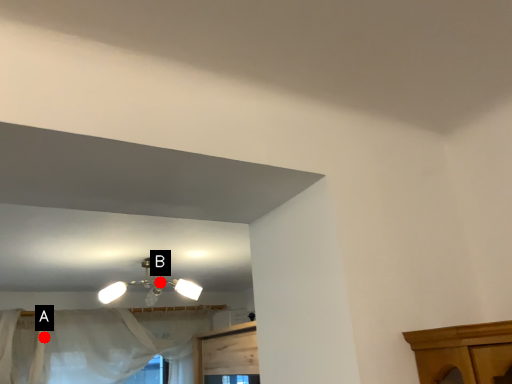
Question: Two points are circled on the image, labeled by A and B beside each circle. Among these points, which one is farthest from the camera?

Choices:
 (A) A is further
 (B) B is further

Answer: (A)